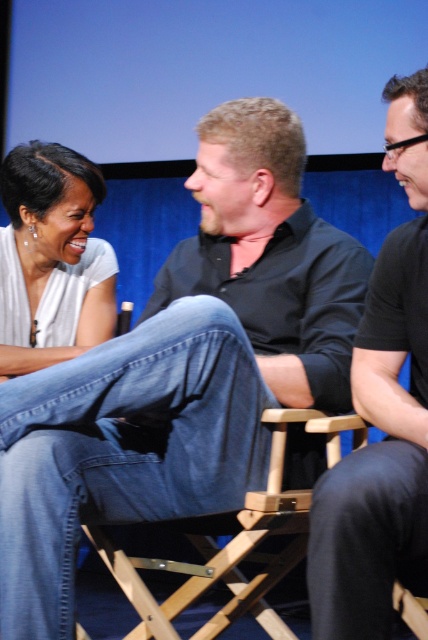
Question: Which object appears closest to the camera in this image?

Choices:
 (A) white matte shirt at upper left
 (B) wooden director's chair at center

Answer: (B)

Question: Which of the following is the closest to the observer?

Choices:
 (A) (116, 563)
 (B) (115, 504)
 (C) (86, 232)
 (D) (342, 625)

Answer: (D)

Question: From the image, what is the correct spatial relationship of black cotton shirt at center in relation to white matte shirt at upper left?

Choices:
 (A) right
 (B) left

Answer: (A)

Question: Is black cotton shirt at center above wooden director's chair at center?

Choices:
 (A) yes
 (B) no

Answer: (A)

Question: Can you confirm if black cotton shirt at center is positioned below black matte shirt at center?

Choices:
 (A) no
 (B) yes

Answer: (B)

Question: Which point appears farthest from the camera in this image?

Choices:
 (A) (76, 429)
 (B) (8, 308)
 (C) (210, 636)
 (D) (356, 349)

Answer: (B)